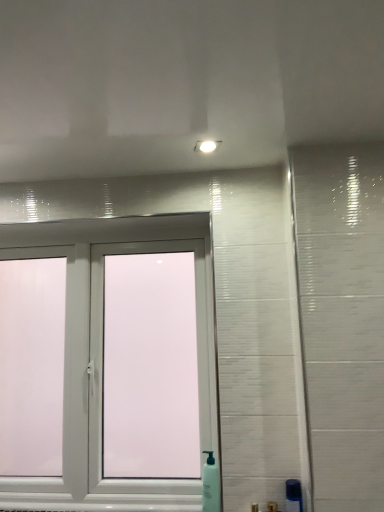
Question: Can we say white plastic window at center lies outside white plastic soap dispenser at lower center, which is the 2th soap dispenser from right to left?

Choices:
 (A) no
 (B) yes

Answer: (B)

Question: From the image's perspective, would you say white plastic window at center is shown under white plastic soap dispenser at lower center, placed as the second soap dispenser when sorted from front to back?

Choices:
 (A) no
 (B) yes

Answer: (A)

Question: Considering the relative positions of white plastic window at center and white plastic soap dispenser at lower center, arranged as the 1th soap dispenser when viewed from the back, in the image provided, is white plastic window at center to the right of white plastic soap dispenser at lower center, arranged as the 1th soap dispenser when viewed from the back, from the viewer's perspective?

Choices:
 (A) no
 (B) yes

Answer: (A)

Question: Is white plastic window at center in front of white plastic soap dispenser at lower center, placed as the second soap dispenser when sorted from front to back?

Choices:
 (A) yes
 (B) no

Answer: (B)

Question: From a real-world perspective, is white plastic window at center physically above white plastic soap dispenser at lower center, positioned as the first soap dispenser in left-to-right order?

Choices:
 (A) no
 (B) yes

Answer: (B)

Question: From a real-world perspective, relative to white plastic soap dispenser at lower center, arranged as the 1th soap dispenser when viewed from the back, is white plastic window at center vertically above or below?

Choices:
 (A) below
 (B) above

Answer: (B)

Question: Based on their sizes in the image, would you say white plastic window at center is bigger or smaller than white plastic soap dispenser at lower center, which is the 2th soap dispenser from right to left?

Choices:
 (A) small
 (B) big

Answer: (B)

Question: Is white plastic window at center wider or thinner than white plastic soap dispenser at lower center, placed as the second soap dispenser when sorted from front to back?

Choices:
 (A) wide
 (B) thin

Answer: (A)

Question: Is white plastic window at center taller or shorter than white plastic soap dispenser at lower center, which is the 2th soap dispenser from right to left?

Choices:
 (A) tall
 (B) short

Answer: (A)

Question: From the image's perspective, is green translucent soap dispenser at lower right, which appears as the first soap dispenser when viewed from the front, located above or below white plastic window at center?

Choices:
 (A) below
 (B) above

Answer: (A)

Question: Choose the correct answer: Is green translucent soap dispenser at lower right, acting as the second soap dispenser starting from the left, inside white plastic window at center or outside it?

Choices:
 (A) inside
 (B) outside

Answer: (B)

Question: From a real-world perspective, is green translucent soap dispenser at lower right, acting as the second soap dispenser starting from the left, positioned above or below white plastic window at center?

Choices:
 (A) above
 (B) below

Answer: (B)

Question: Is green translucent soap dispenser at lower right, the second soap dispenser when ordered from back to front, bigger or smaller than white plastic window at center?

Choices:
 (A) small
 (B) big

Answer: (A)

Question: Considering the positions of point (203, 501) and point (210, 395), is point (203, 501) closer or farther from the camera than point (210, 395)?

Choices:
 (A) closer
 (B) farther

Answer: (A)

Question: Would you say white plastic soap dispenser at lower center, placed as the second soap dispenser when sorted from front to back, is to the left or to the right of white plastic window at center in the picture?

Choices:
 (A) right
 (B) left

Answer: (A)